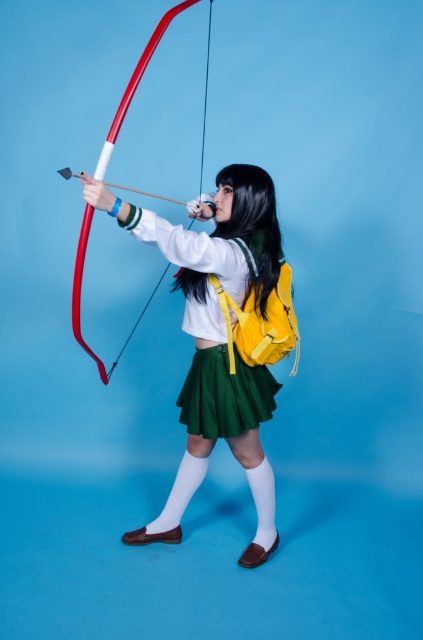
You are a photographer trying to capture the shiny red bow at center and the matte white sweater at center in a single shot. Which object will appear closer to the camera in the photo?

The matte white sweater at center is further to the viewer than the shiny red bow at center, so it will appear closer to the camera in the photo.

You are a photographer trying to capture the perfect shot of the archer in the scene. You want to focus on the point at coordinates point (183, 266). If your camera has a focal length of 50mm and you are positioned 2.14 meters away from that point, what is the approximate angle of view required to ensure the entire archer and their equipment are in frame?

The point (183, 266) is 2.14 meters away from the camera. To calculate the angle of view, use the formula angle of view in degrees equals arctangent of object distance divided by focal length multiplied by 57.3. Plugging in the values, angle of view equals arctangent of 2.14 divided by 50 times 57.3, which results in approximately 4.9 degrees. This angle ensures the entire archer and equipment are in frame.

What is the 2D coordinate of the matte white sweater at center?

The 2D coordinate of the matte white sweater at center is at point (222,337).